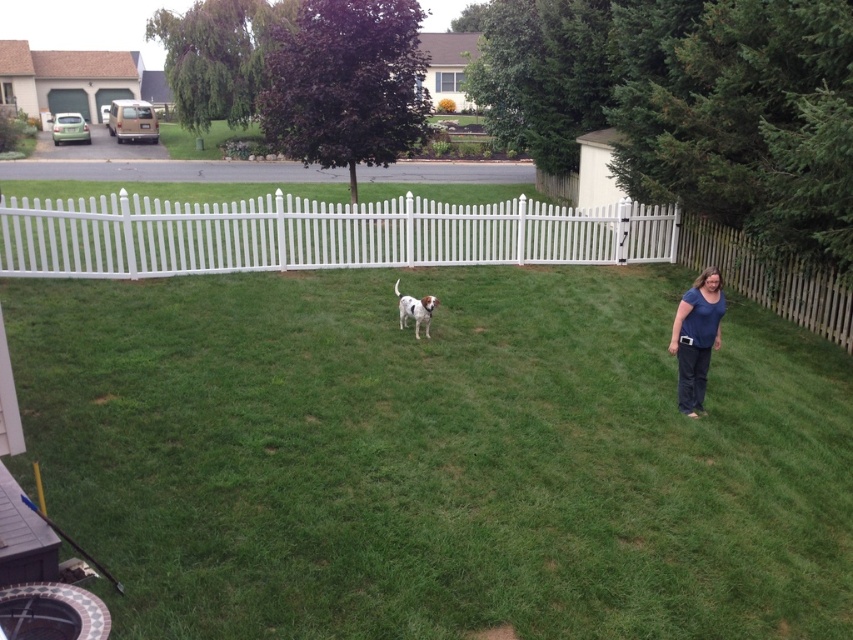
Question: Is green grass at center to the left of white picket fence at center from the viewer's perspective?

Choices:
 (A) no
 (B) yes

Answer: (A)

Question: Which point appears closest to the camera in this image?

Choices:
 (A) (705, 342)
 (B) (546, 244)

Answer: (A)

Question: Where is white picket fence at center located in relation to white plastic picket fence at center in the image?

Choices:
 (A) above
 (B) below

Answer: (A)

Question: Estimate the real-world distances between objects in this image. Which object is farther from the white picket fence at center?

Choices:
 (A) green grass at center
 (B) white plastic picket fence at center

Answer: (A)

Question: Is green grass at center wider than blue cotton shirt at center-right?

Choices:
 (A) yes
 (B) no

Answer: (A)

Question: Which is nearer to the blue cotton shirt at center-right?

Choices:
 (A) white plastic picket fence at center
 (B) white picket fence at center

Answer: (B)